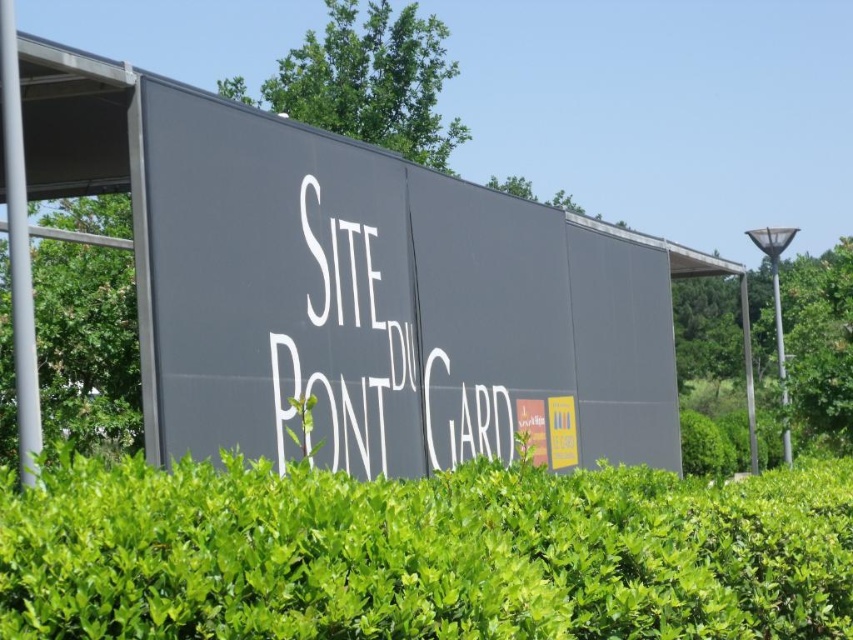
Question: Is the position of matte gray sign at center more distant than that of green leafy hedge at center?

Choices:
 (A) no
 (B) yes

Answer: (B)

Question: Among these points, which one is farthest from the camera?

Choices:
 (A) (235, 600)
 (B) (68, 358)
 (C) (572, 388)

Answer: (B)

Question: Which of the following is the closest to the observer?

Choices:
 (A) green leafy hedge at center
 (B) matte gray sign at center
 (C) green leafy bush at left

Answer: (A)

Question: Is green leafy hedge at center below green leafy bush at left?

Choices:
 (A) no
 (B) yes

Answer: (B)

Question: Which of the following is the farthest from the observer?

Choices:
 (A) (99, 442)
 (B) (57, 486)

Answer: (A)

Question: Considering the relative positions of matte gray sign at center and green leafy hedge at center in the image provided, where is matte gray sign at center located with respect to green leafy hedge at center?

Choices:
 (A) left
 (B) right

Answer: (B)